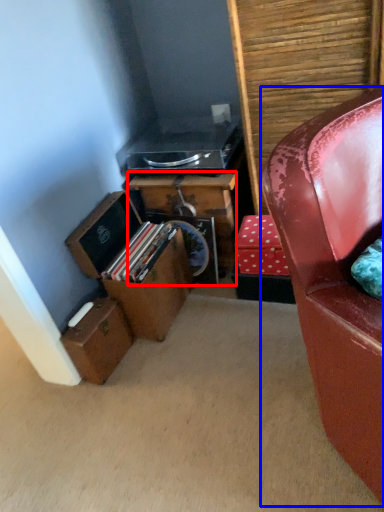
Question: Which of the following is the closest to the observer, desk (highlighted by a red box) or chair (highlighted by a blue box)?

Choices:
 (A) desk
 (B) chair

Answer: (B)